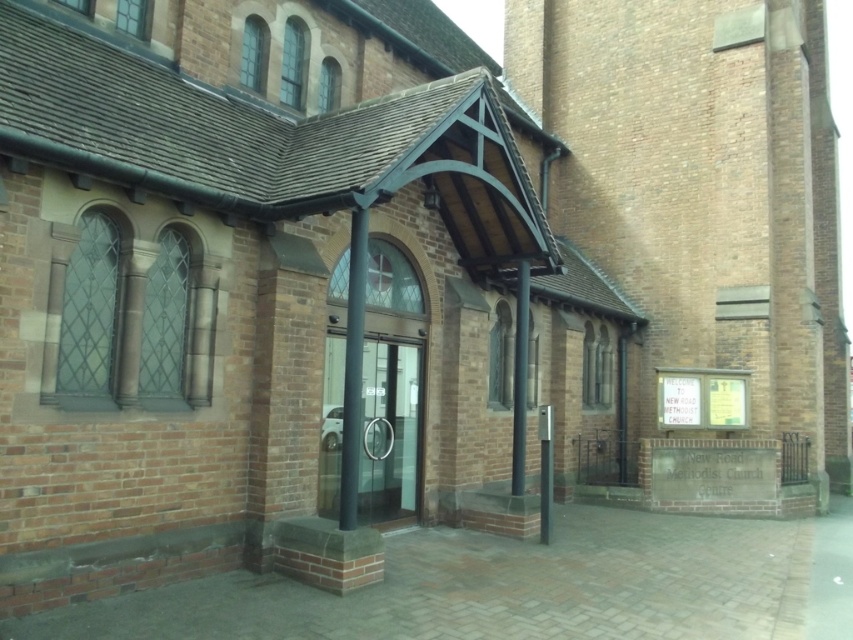
You are a delivery person trying to enter the New Road Methodist Church Centre. You notice the clear glass door at center and the black smooth pole at center. Which object is taller?

The black smooth pole at center is taller than the clear glass door at center.

You are a delivery person standing at the entrance of the New Road Methodist Church Centre. You need to place a package on the ground exactly 10 meters away from the clear glass door at center. Can you place it there from your current position?

The distance between the clear glass door at center and the camera is 9.80 meters. Since you are standing at the entrance near the clear glass door at center, placing the package 10 meters away would require moving an additional 0.20 meters forward from your current position.

You are standing in front of the New Road Methodist Church Centre. You see a point marked at coordinates (389, 432). What object is located at this point?

The point at coordinates (389, 432) corresponds to the clear glass door at center.